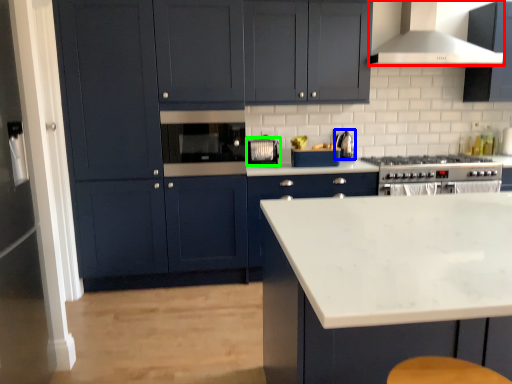
Question: Estimate the real-world distances between objects in this image. Which object is closer to home appliance (highlighted by a red box), kitchen appliance (highlighted by a blue box) or appliance (highlighted by a green box)?

Choices:
 (A) kitchen appliance
 (B) appliance

Answer: (A)